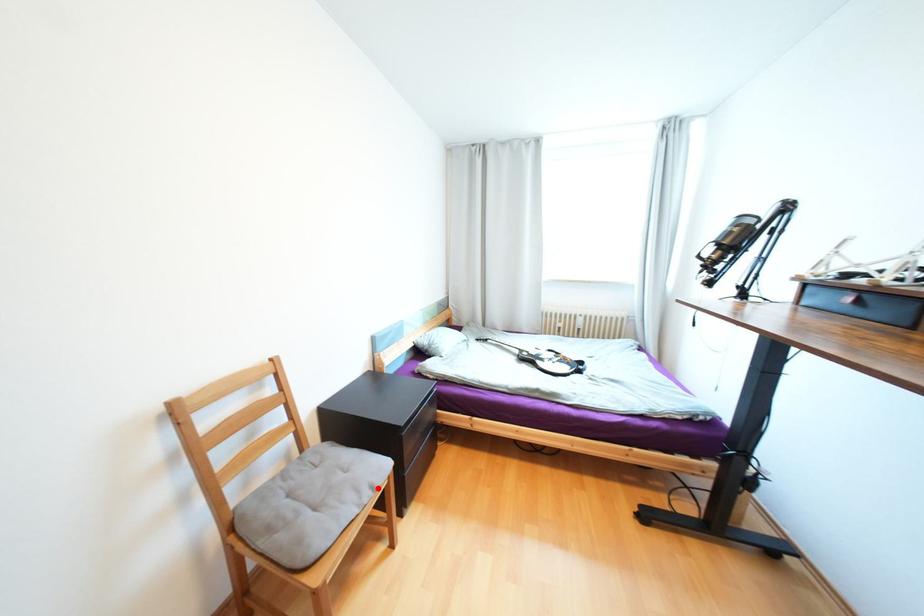
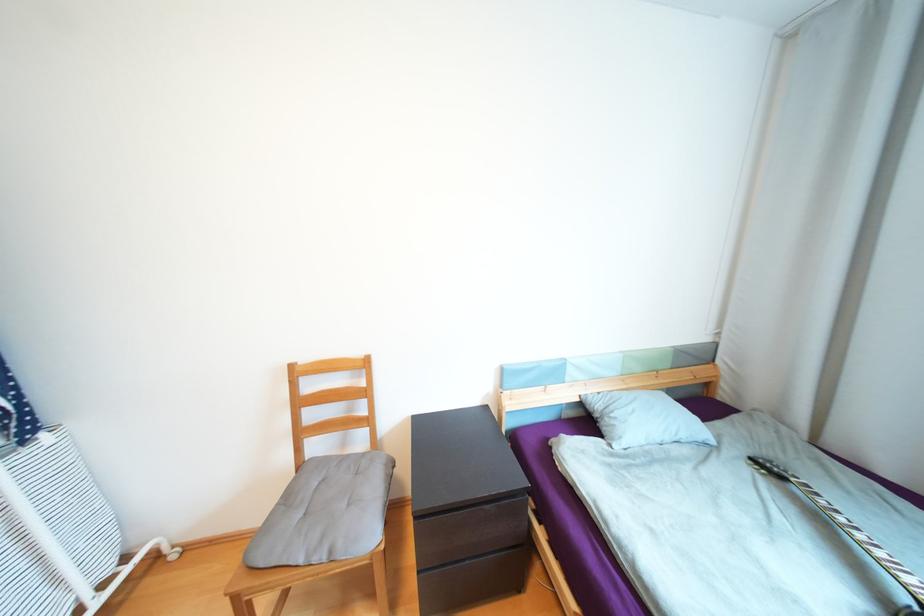
Where in the second image is the point corresponding to the highlighted location from the first image?

(335, 553)